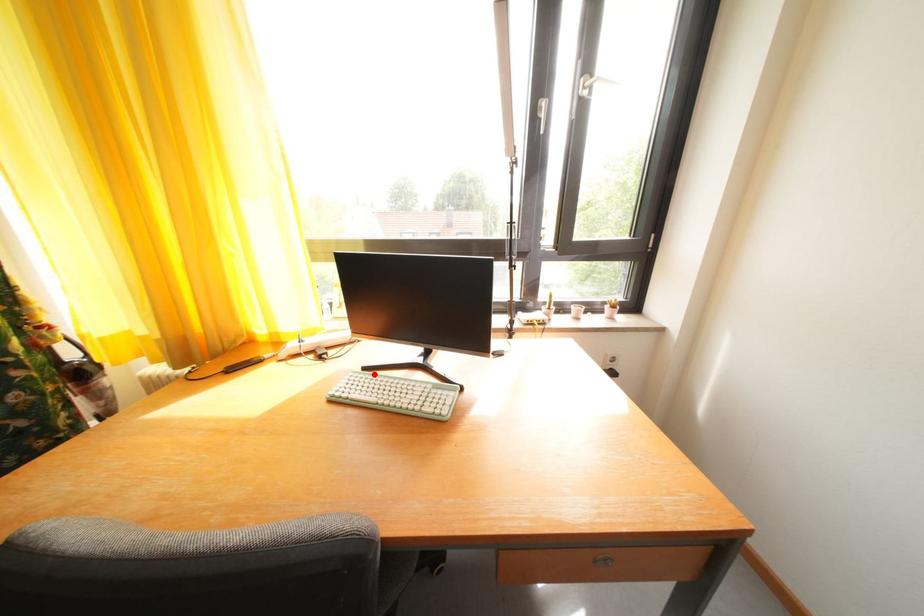
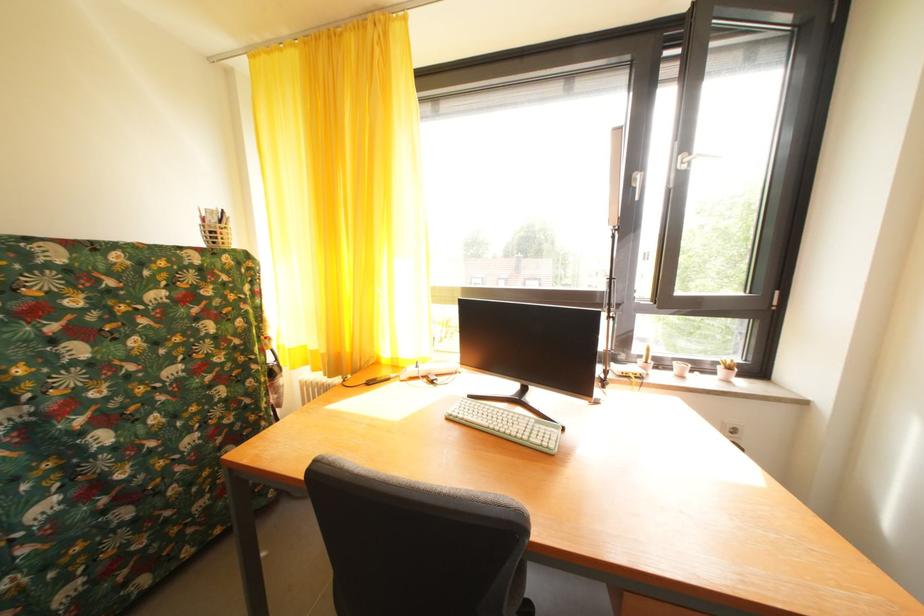
In the second image, find the point that corresponds to the highlighted location in the first image.

(479, 402)